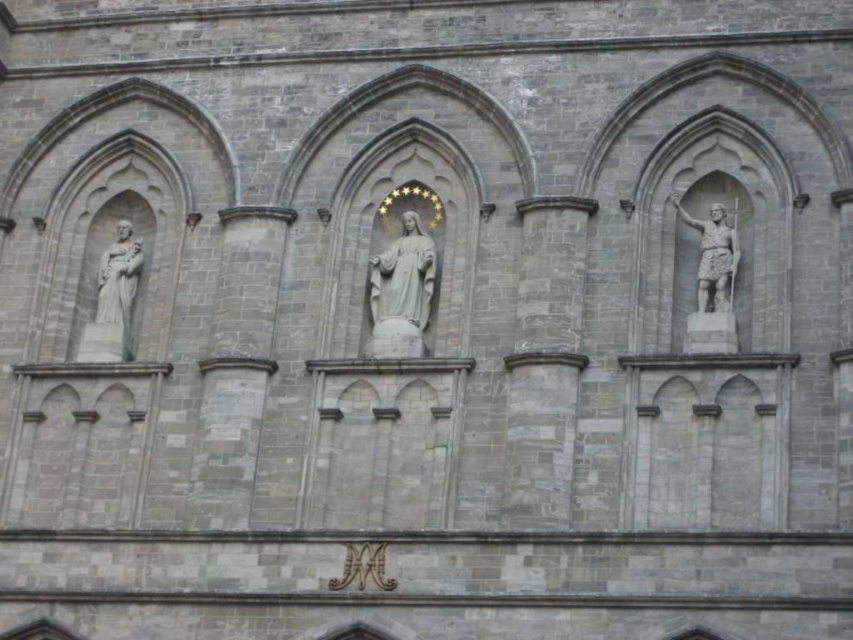
You are an architect analyzing the facade of a historical building. You notice two points marked on the facade at coordinates point (407, 266) and point (120, 230). Based on the spatial relationship between these points, which point is closer to the viewer?

Point (407, 266) is in front of point (120, 230), so it is closer to the viewer.

You are an art conservator examining the stone building facade. You need to assess the distance between the polished bronze statue at upper right and the white marble statue at center. Which statue is nearer to you?

The polished bronze statue at upper right is closer to the viewer than the white marble statue at center.